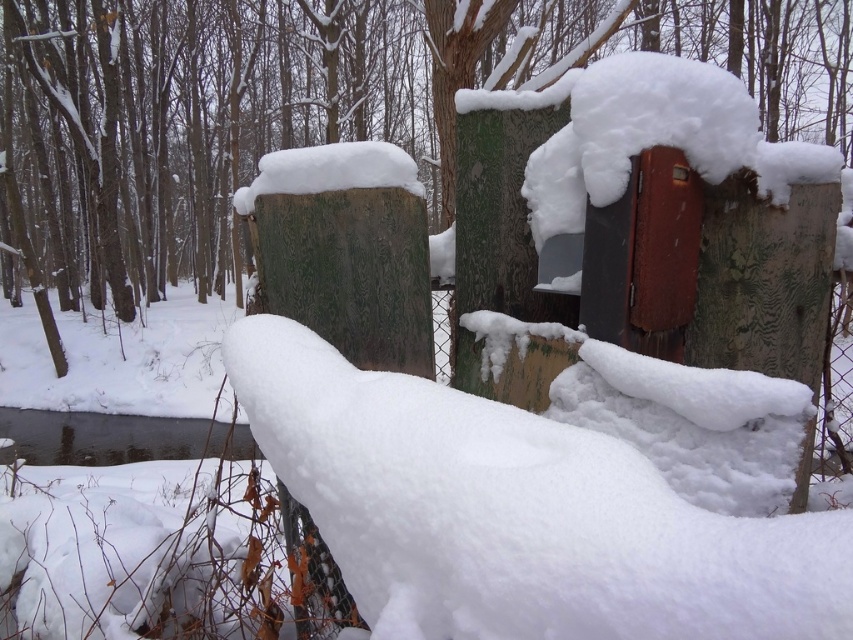
Question: Which point is farther to the camera?

Choices:
 (A) clear ice water at lower left
 (B) white fluffy snow at center

Answer: (A)

Question: Which of the following is the farthest from the observer?

Choices:
 (A) clear ice water at lower left
 (B) white fluffy snow at center

Answer: (A)

Question: Is white fluffy snow at center positioned in front of clear ice water at lower left?

Choices:
 (A) no
 (B) yes

Answer: (B)

Question: Can you confirm if white fluffy snow at center is smaller than clear ice water at lower left?

Choices:
 (A) no
 (B) yes

Answer: (B)

Question: Does white fluffy snow at center appear on the left side of clear ice water at lower left?

Choices:
 (A) yes
 (B) no

Answer: (B)

Question: Which of the following is the closest to the observer?

Choices:
 (A) clear ice water at lower left
 (B) white fluffy snow at center

Answer: (B)